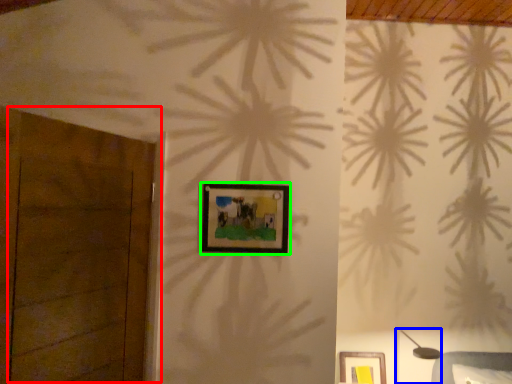
Question: Based on their relative distances, which object is farther from door (highlighted by a red box)? Choose from table lamp (highlighted by a blue box) and picture frame (highlighted by a green box).

Choices:
 (A) table lamp
 (B) picture frame

Answer: (A)